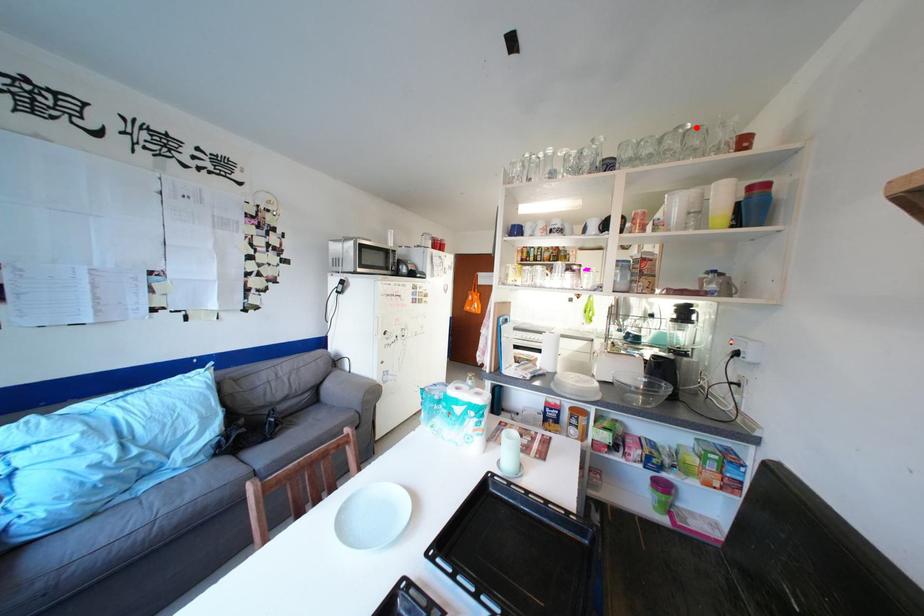
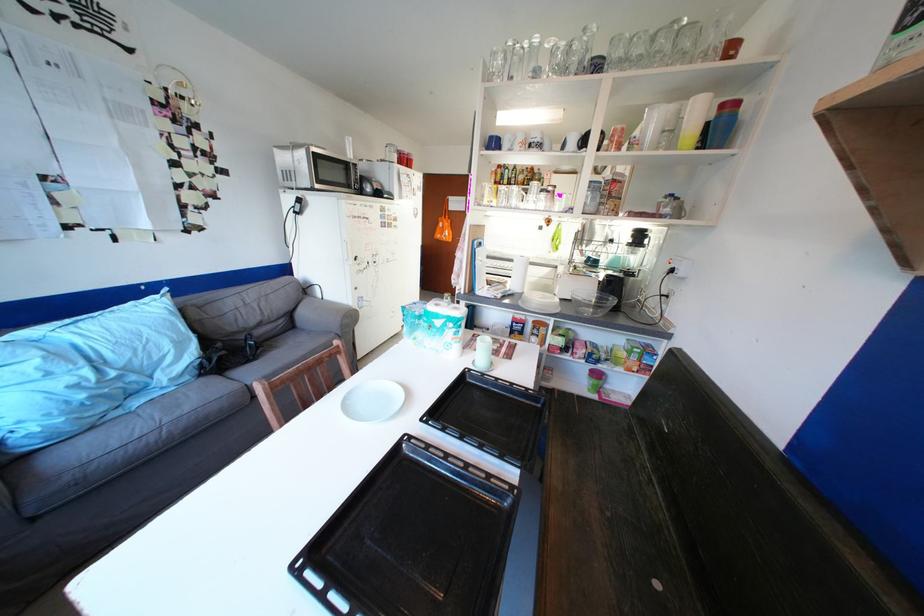
Locate, in the second image, the point that corresponds to the highlighted location in the first image.

(694, 23)